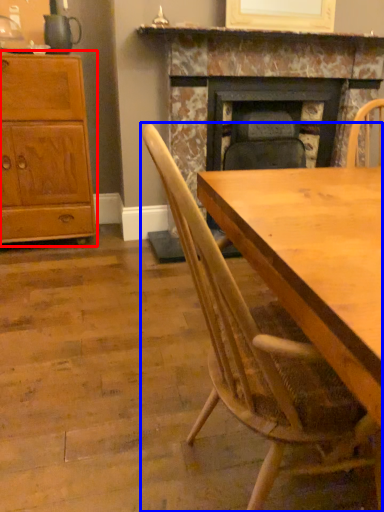
Question: Which of the following is the closest to the observer, cabinetry (highlighted by a red box) or chair (highlighted by a blue box)?

Choices:
 (A) cabinetry
 (B) chair

Answer: (B)